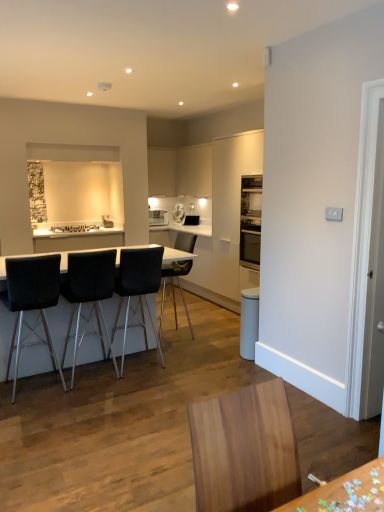
The width and height of the screenshot is (384, 512). Describe the element at coordinates (59, 324) in the screenshot. I see `white glossy table at center` at that location.

Where is `white glossy cabinet at upper center, placed as the first cabinetry when sorted from left to right`? This screenshot has height=512, width=384. white glossy cabinet at upper center, placed as the first cabinetry when sorted from left to right is located at coordinates (162, 172).

The height and width of the screenshot is (512, 384). Identify the location of black leather chair at center, marked as the fourth chair in a left-to-right arrangement. (173, 288).

In order to face black leather chair at center, the third chair positioned from the left, should I rotate leftwards or rightwards?

To face it directly, rotate left by 7.574 degrees.

Identify the location of black leather chair at center, acting as the 2th chair starting from the left. The height and width of the screenshot is (512, 384). (88, 292).

Is point (110, 312) farther from viewer compared to point (184, 243)?

No, (110, 312) is closer to viewer.

Which object is closer to the camera, white glossy table at center or black leather chair at center, which ranks as the 1th chair in right-to-left order?

white glossy table at center is more forward.

Is white glossy table at center wider or thinner than black leather chair at center, which ranks as the 1th chair in right-to-left order?

white glossy table at center is wider than black leather chair at center, which ranks as the 1th chair in right-to-left order.

How different are the orientations of white glossy table at center and black leather chair at center, marked as the fourth chair in a left-to-right arrangement, in degrees?

The angular difference between white glossy table at center and black leather chair at center, marked as the fourth chair in a left-to-right arrangement, is 88.3 degrees.

Is the surface of white glossy cabinet at upper center, the 2th cabinetry viewed from the right, in direct contact with black leather chair at center, the third chair positioned from the left?

No, white glossy cabinet at upper center, the 2th cabinetry viewed from the right, is not making contact with black leather chair at center, the third chair positioned from the left.

Which point is more forward, (164,188) or (141,311)?

The point (141,311) is closer to the camera.

Looking at this image, how different are the orientations of white glossy cabinet at upper center, placed as the first cabinetry when sorted from left to right, and black leather chair at center, the third chair positioned from the left, in degrees?

The facing directions of white glossy cabinet at upper center, placed as the first cabinetry when sorted from left to right, and black leather chair at center, the third chair positioned from the left, are 179 degrees apart.

Can you confirm if white glossy cabinet at upper center, placed as the first cabinetry when sorted from left to right, is smaller than black leather chair at center, the third chair positioned from the left?

Correct, white glossy cabinet at upper center, placed as the first cabinetry when sorted from left to right, occupies less space than black leather chair at center, the third chair positioned from the left.

Consider the image. In terms of width, does white glossy coffee machine at center look wider or thinner when compared to white glossy cabinet at upper center, which is the first cabinetry in right-to-left order?

In the image, white glossy coffee machine at center appears to be more narrow than white glossy cabinet at upper center, which is the first cabinetry in right-to-left order.

Is white glossy coffee machine at center turned away from white glossy cabinet at upper center, which is the first cabinetry in right-to-left order?

white glossy coffee machine at center is not turned away from white glossy cabinet at upper center, which is the first cabinetry in right-to-left order.

Is there a large distance between white glossy coffee machine at center and white glossy cabinet at upper center, placed as the 2th cabinetry when sorted from left to right?

No, there isn't a large distance between white glossy coffee machine at center and white glossy cabinet at upper center, placed as the 2th cabinetry when sorted from left to right.

Is white glossy coffee machine at center inside or outside of white glossy cabinet at upper center, placed as the 2th cabinetry when sorted from left to right?

white glossy coffee machine at center cannot be found inside white glossy cabinet at upper center, placed as the 2th cabinetry when sorted from left to right.

Who is smaller, white glossy coffee machine at center or black fabric chair at left, which is the first chair from left to right?

Smaller between the two is white glossy coffee machine at center.

Between point (181, 208) and point (41, 319), which one is positioned behind?

The point (181, 208) is behind.

How distant is white glossy coffee machine at center from black fabric chair at left, the fourth chair in the right-to-left sequence?

3.59 meters.

Is black fabric chair at left, which is the first chair from left to right, located within white glossy coffee machine at center?

No, black fabric chair at left, which is the first chair from left to right, is not a part of white glossy coffee machine at center.

Which is in front, point (205, 165) or point (52, 313)?

Point (52, 313)

Does white glossy cabinet at upper center, placed as the 2th cabinetry when sorted from left to right, contain white glossy table at center?

No, white glossy table at center is not inside white glossy cabinet at upper center, placed as the 2th cabinetry when sorted from left to right.

From a real-world perspective, which is physically below, white glossy cabinet at upper center, which is the first cabinetry in right-to-left order, or white glossy table at center?

In real-world perspective, white glossy table at center is lower.

From the image's perspective, does white glossy cabinet at upper center, placed as the 2th cabinetry when sorted from left to right, appear lower than white glossy coffee machine at center?

Incorrect, from the image's perspective, white glossy cabinet at upper center, placed as the 2th cabinetry when sorted from left to right, is higher than white glossy coffee machine at center.

Is there a large distance between white glossy cabinet at upper center, which is the first cabinetry in right-to-left order, and white glossy coffee machine at center?

They are positioned close to each other.

Is point (185, 178) positioned after point (183, 212)?

That is True.

Can you tell me how much white glossy cabinet at upper center, which is the first cabinetry in right-to-left order, and white glossy coffee machine at center differ in facing direction?

white glossy cabinet at upper center, which is the first cabinetry in right-to-left order, and white glossy coffee machine at center are facing 56.5 degrees away from each other.

How far apart are black fabric chair at left, which is the first chair from left to right, and white glossy table at center?

20.49 inches.

Is black fabric chair at left, which is the first chair from left to right, placed right next to white glossy table at center?

No, black fabric chair at left, which is the first chair from left to right, is not touching white glossy table at center.

In the scene shown: What's the angular difference between black fabric chair at left, which is the first chair from left to right, and white glossy table at center's facing directions?

They differ by 3.16 degrees in their facing directions.

Which is more to the right, black fabric chair at left, the fourth chair in the right-to-left sequence, or white glossy table at center?

white glossy table at center.

In the image, there is a black leather chair at center, which ranks as the 1th chair in right-to-left order. Identify the location of table below it (from the image's perspective). This screenshot has height=512, width=384. (59, 324).

Locate an element on the screen. The width and height of the screenshot is (384, 512). chair that is the 1st one when counting rightward from the white glossy cabinet at upper center, the 2th cabinetry viewed from the right is located at coordinates (138, 287).

In the scene shown: Considering their positions, is black leather chair at center, which ranks as the 1th chair in right-to-left order, positioned further to black leather chair at center, which is counted as the third chair, starting from the right, than black fabric chair at left, which is the first chair from left to right?

black leather chair at center, which ranks as the 1th chair in right-to-left order, is further to black leather chair at center, which is counted as the third chair, starting from the right.

Based on their spatial positions, is black leather chair at center, which ranks as the 1th chair in right-to-left order, or black leather chair at center, which is counted as the third chair, starting from the right, further from black fabric chair at left, which is the first chair from left to right?

black leather chair at center, which ranks as the 1th chair in right-to-left order, is positioned further to the anchor black fabric chair at left, which is the first chair from left to right.

Consider the image. Considering their positions, is black leather chair at center, acting as the 2th chair starting from the left, positioned further to black leather chair at center, which ranks as the 1th chair in right-to-left order, than white glossy cabinet at upper center, placed as the 2th cabinetry when sorted from left to right?

black leather chair at center, acting as the 2th chair starting from the left, is positioned further to the anchor black leather chair at center, which ranks as the 1th chair in right-to-left order.

Considering their positions, is black leather chair at center, the third chair positioned from the left, positioned further to white glossy cabinet at upper center, placed as the 2th cabinetry when sorted from left to right, than white glossy microwave at upper center?

black leather chair at center, the third chair positioned from the left, lies further to white glossy cabinet at upper center, placed as the 2th cabinetry when sorted from left to right, than the other object.

Based on their spatial positions, is black leather chair at center, which ranks as the 1th chair in right-to-left order, or white glossy microwave at upper center further from black leather chair at center, placed as the 2th chair when sorted from right to left?

Based on the image, white glossy microwave at upper center appears to be further to black leather chair at center, placed as the 2th chair when sorted from right to left.

Considering their positions, is white glossy cabinet at upper center, placed as the first cabinetry when sorted from left to right, positioned further to white glossy coffee machine at center than black leather chair at center, placed as the 2th chair when sorted from right to left?

black leather chair at center, placed as the 2th chair when sorted from right to left.

Looking at the image, which one is located further to white glossy table at center, black leather chair at center, placed as the 2th chair when sorted from right to left, or black fabric chair at left, the fourth chair in the right-to-left sequence?

black fabric chair at left, the fourth chair in the right-to-left sequence.

Looking at the image, which one is located closer to white glossy cabinet at upper center, which is the first cabinetry in right-to-left order, black leather chair at center, the third chair positioned from the left, or black leather chair at center, acting as the 2th chair starting from the left?

black leather chair at center, the third chair positioned from the left, lies closer to white glossy cabinet at upper center, which is the first cabinetry in right-to-left order, than the other object.

Where is `table between black fabric chair at left, which is the first chair from left to right, and white glossy cabinet at upper center, the 2th cabinetry viewed from the right, along the z-axis`? table between black fabric chair at left, which is the first chair from left to right, and white glossy cabinet at upper center, the 2th cabinetry viewed from the right, along the z-axis is located at coordinates (59, 324).

Find the location of a particular element. table between black fabric chair at left, the fourth chair in the right-to-left sequence, and white glossy cabinet at upper center, which is the first cabinetry in right-to-left order, in the front-back direction is located at coordinates coord(59,324).

Where is `cabinetry located between black leather chair at center, the third chair positioned from the left, and white glossy cabinet at upper center, placed as the first cabinetry when sorted from left to right, in the depth direction`? This screenshot has height=512, width=384. cabinetry located between black leather chair at center, the third chair positioned from the left, and white glossy cabinet at upper center, placed as the first cabinetry when sorted from left to right, in the depth direction is located at coordinates (194, 170).

Locate an element on the screen. Image resolution: width=384 pixels, height=512 pixels. appliance between white glossy cabinet at upper center, placed as the 2th cabinetry when sorted from left to right, and white glossy coffee machine at center, along the z-axis is located at coordinates (158, 217).